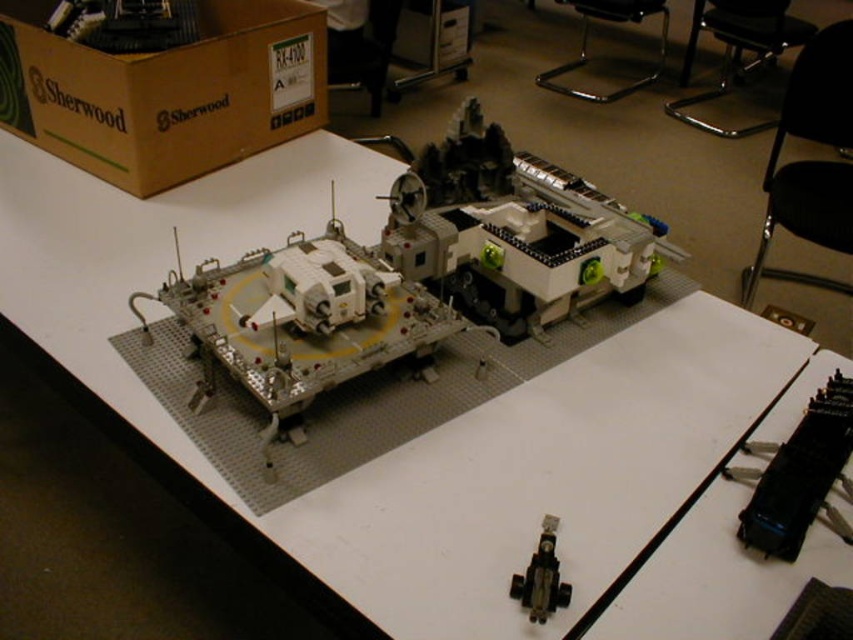
You are standing in front of a LEGO model of a space exploration vehicle displayed on a white table. You notice a specific point marked at coordinates (410, 275). What object is located at that point?

The point at coordinates (410, 275) corresponds to the beige plastic space vehicle at center.

You are an astronaut preparing for a mission and need to choose between the beige plastic space vehicle at center and the white plastic vehicle at center. Which one would you select if you prefer a larger spacecraft for better equipment storage?

The beige plastic space vehicle at center is larger than the white plastic vehicle at center, so you should choose the beige plastic space vehicle at center for better equipment storage.

You are an astronaut preparing to board a spacecraft. You see a beige plastic space vehicle at center and a white plastic vehicle at center. Which one is wider?

The beige plastic space vehicle at center is wider than the white plastic vehicle at center.